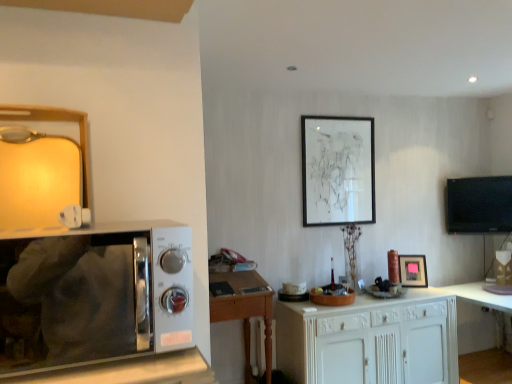
Question: Looking at the image, does white wood cabinet at center seem bigger or smaller compared to wooden desk at center?

Choices:
 (A) big
 (B) small

Answer: (A)

Question: Considering the positions of white wood cabinet at center and wooden desk at center in the image, is white wood cabinet at center taller or shorter than wooden desk at center?

Choices:
 (A) tall
 (B) short

Answer: (B)

Question: Which object is the closest to the sleek silver microwave at left?

Choices:
 (A) matte black picture frame at center, which is the 1th picture frame in right-to-left order
 (B) white wood cabinet at center
 (C) wooden desk at center
 (D) matte black picture frame at upper center, which is counted as the 1th picture frame, starting from the top
 (E) black glossy tv at right

Answer: (C)

Question: Based on their relative distances, which object is nearer to the wooden desk at center?

Choices:
 (A) black glossy tv at right
 (B) matte black picture frame at upper center, which is counted as the 2th picture frame, starting from the bottom
 (C) sleek silver microwave at left
 (D) white glossy table at lower right
 (E) matte black picture frame at center, which is the second picture frame from top to bottom

Answer: (B)